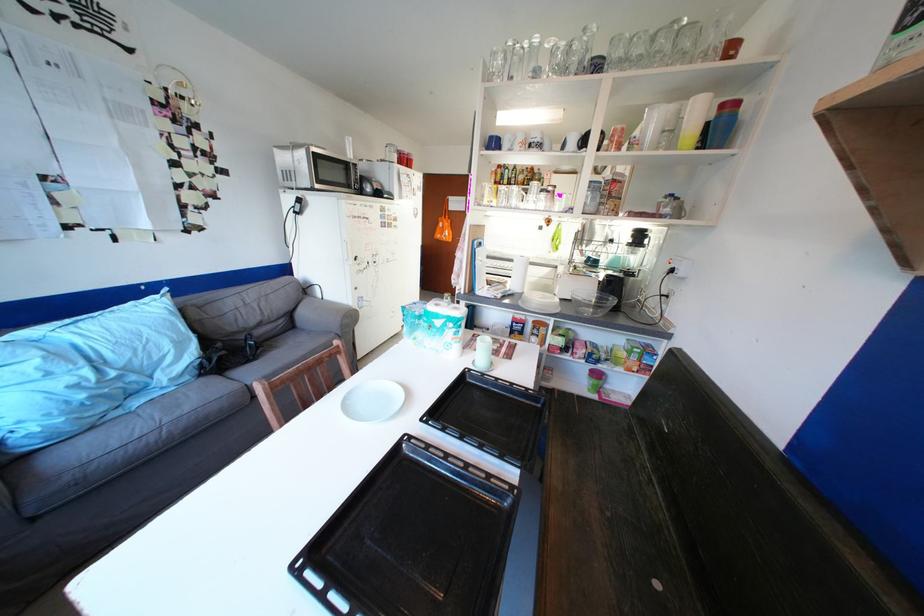
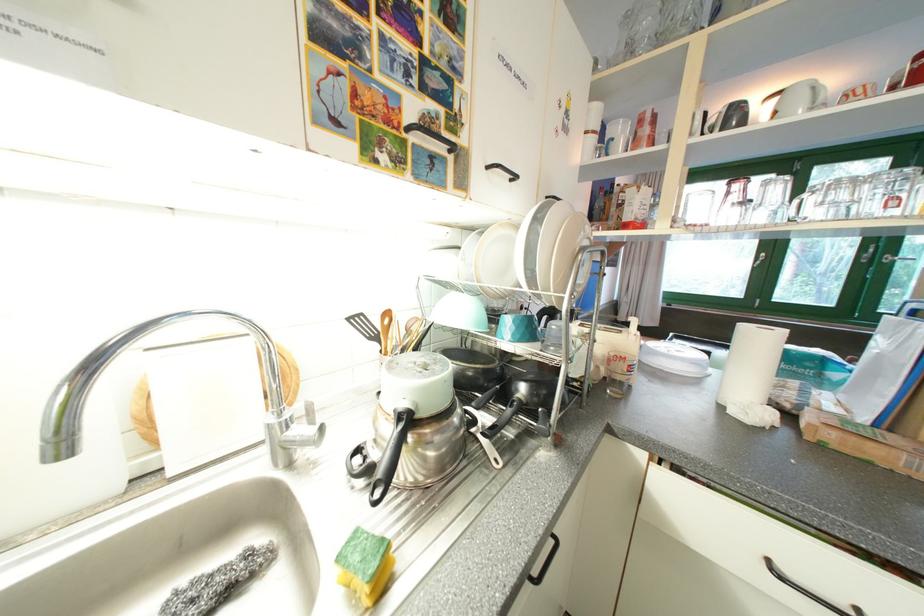
Question: I am providing you with two images of the same scene from different viewpoints. After the viewpoint changes to image2, which objects are now occluded?

Choices:
 (A) light blue bowl
 (B) faucet handle
 (C) black baking tray
 (D) green drink can

Answer: (C)